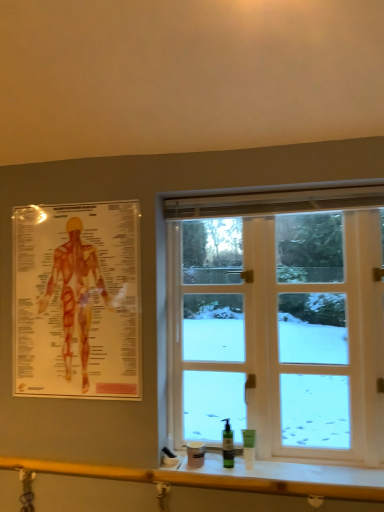
This screenshot has width=384, height=512. In order to click on free space to the left of green matte pump bottle at lower center, the 2th toiletry when ordered from right to left in this screenshot , I will do `click(203, 455)`.